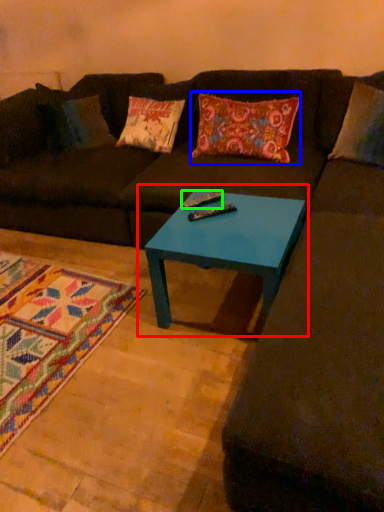
Question: Which object is the closest to the coffee table (highlighted by a red box)? Choose among these: throw pillow (highlighted by a blue box) or remote (highlighted by a green box).

Choices:
 (A) throw pillow
 (B) remote

Answer: (B)